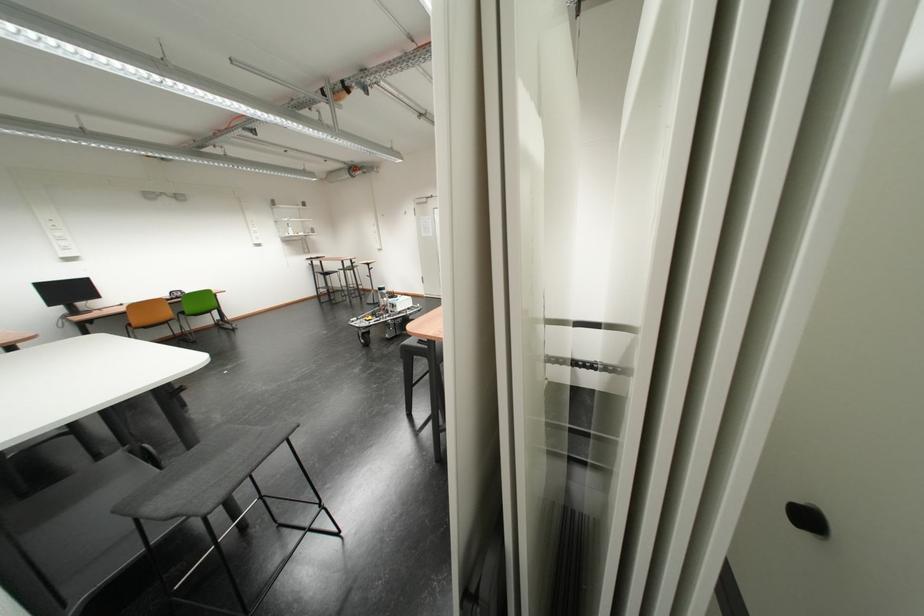
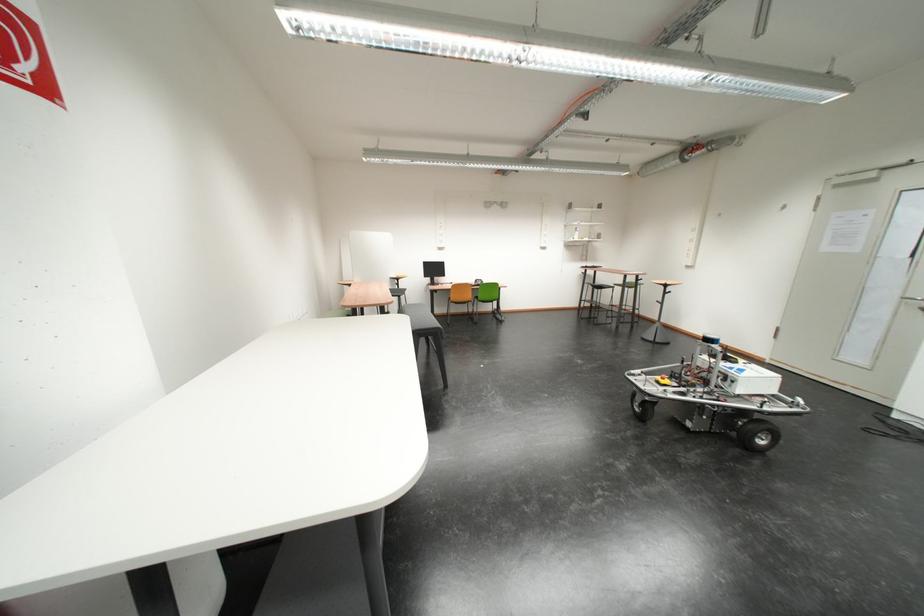
The point at (380, 321) is marked in the first image. Where is the corresponding point in the second image?

(674, 384)